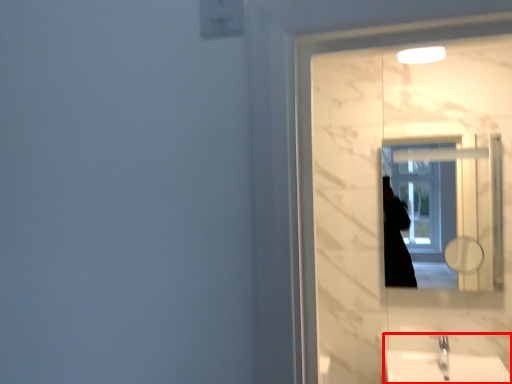
Question: From the image's perspective, what is the correct spatial relationship of sink (annotated by the red box) in relation to mirror?

Choices:
 (A) above
 (B) below

Answer: (B)